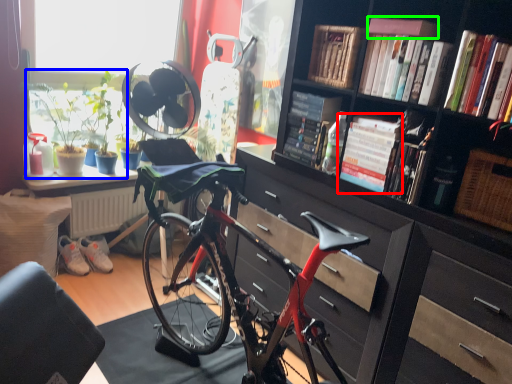
Question: Which object is the farthest from book (highlighted by a red box)? Choose among these: houseplant (highlighted by a blue box) or book (highlighted by a green box).

Choices:
 (A) houseplant
 (B) book

Answer: (A)